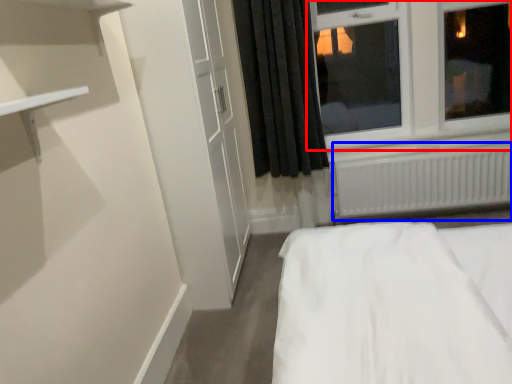
Question: Which object appears closest to the camera in this image, window (highlighted by a red box) or radiator (highlighted by a blue box)?

Choices:
 (A) window
 (B) radiator

Answer: (A)